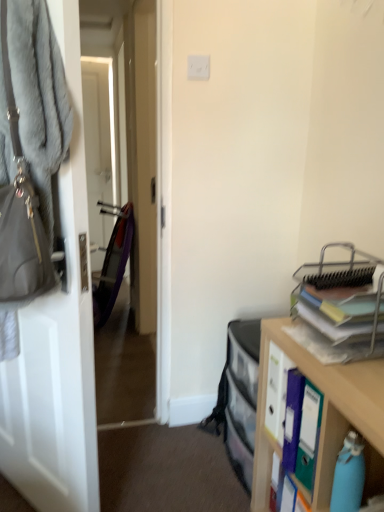
The image size is (384, 512). What are the coordinates of `gray furry handbag at left` in the screenshot? It's located at (20, 215).

This screenshot has height=512, width=384. In order to click on wooden cabinet at right in this screenshot , I will do `click(323, 416)`.

Measure the distance between metallic silver organizer at right and camera.

The distance of metallic silver organizer at right from camera is 1.09 meters.

Image resolution: width=384 pixels, height=512 pixels. What are the coordinates of `metallic silver organizer at right` in the screenshot? It's located at (344, 307).

Where is `gray furry handbag at left`? Image resolution: width=384 pixels, height=512 pixels. gray furry handbag at left is located at coordinates (20, 215).

How far apart are metallic silver organizer at right and wooden cabinet at right?

A distance of 8.04 inches exists between metallic silver organizer at right and wooden cabinet at right.

Consider the image. Is metallic silver organizer at right situated inside wooden cabinet at right or outside?

metallic silver organizer at right cannot be found inside wooden cabinet at right.

Is metallic silver organizer at right in front of or behind wooden cabinet at right in the image?

metallic silver organizer at right is behind wooden cabinet at right.

Does metallic silver organizer at right turn towards wooden cabinet at right?

No, metallic silver organizer at right is not turned towards wooden cabinet at right.

Is gray furry handbag at left at the right side of wooden cabinet at right?

No, gray furry handbag at left is not to the right of wooden cabinet at right.

Could you tell me if gray furry handbag at left is facing wooden cabinet at right?

No, gray furry handbag at left is not turned towards wooden cabinet at right.

From the picture: Can you confirm if gray furry handbag at left is smaller than wooden cabinet at right?

Correct, gray furry handbag at left occupies less space than wooden cabinet at right.

Is gray furry handbag at left directly adjacent to wooden cabinet at right?

No, gray furry handbag at left is not with wooden cabinet at right.

Can you confirm if wooden cabinet at right is wider than gray fuzzy coat at left?

Yes.

Which point is more distant from viewer, (265, 485) or (116, 309)?

The point (116, 309) is farther.

Which of these two, wooden cabinet at right or gray fuzzy coat at left, is bigger?

With larger size is wooden cabinet at right.

Is the position of white matte door at left less distant than that of gray fuzzy coat at left?

Yes, the depth of white matte door at left is less than that of gray fuzzy coat at left.

Is white matte door at left looking in the opposite direction of gray fuzzy coat at left?

Correct, white matte door at left is looking away from gray fuzzy coat at left.

From a real-world perspective, is white matte door at left above or below gray fuzzy coat at left?

From a real-world perspective, white matte door at left is physically below gray fuzzy coat at left.

Are white matte door at left and gray fuzzy coat at left located far from each other?

They are positioned close to each other.

From a real-world perspective, is metallic silver organizer at right positioned above or below gray furry handbag at left?

Clearly, from a real-world perspective, metallic silver organizer at right is below gray furry handbag at left.

Is metallic silver organizer at right situated inside gray furry handbag at left or outside?

metallic silver organizer at right cannot be found inside gray furry handbag at left.

Who is shorter, metallic silver organizer at right or gray furry handbag at left?

Standing shorter between the two is metallic silver organizer at right.

Consider the image. Is the surface of metallic silver organizer at right in direct contact with gray furry handbag at left?

No, metallic silver organizer at right is not next to gray furry handbag at left.

Is gray furry handbag at left inside or outside of white matte door at left?

gray furry handbag at left is not enclosed by white matte door at left.

Which is closer to the camera, (5, 48) or (69, 47)?

Point (5, 48) is positioned closer to the camera compared to point (69, 47).

Find the location of a particular element. The height and width of the screenshot is (512, 384). handbag on the right side of white matte door at left is located at coordinates (20, 215).

From the image's perspective, is gray furry handbag at left under white matte door at left?

No, from the image's perspective, gray furry handbag at left is not beneath white matte door at left.

From the image's perspective, is gray fuzzy coat at left located above metallic silver organizer at right?

Yes, from the image's perspective, gray fuzzy coat at left is on top of metallic silver organizer at right.

Consider the image. Who is shorter, gray fuzzy coat at left or metallic silver organizer at right?

Standing shorter between the two is metallic silver organizer at right.

Does gray fuzzy coat at left turn towards metallic silver organizer at right?

No, gray fuzzy coat at left is not oriented towards metallic silver organizer at right.

How many degrees apart are the facing directions of gray fuzzy coat at left and metallic silver organizer at right?

89.1 degrees separate the facing orientations of gray fuzzy coat at left and metallic silver organizer at right.

Identify the location of cabinetry on the left of metallic silver organizer at right. (323, 416).

This screenshot has width=384, height=512. Identify the location of handbag above the wooden cabinet at right (from a real-world perspective). (20, 215).

When comparing their distances from wooden cabinet at right, does gray furry handbag at left or gray fuzzy coat at left seem further?

gray fuzzy coat at left is further to wooden cabinet at right.

Estimate the real-world distances between objects in this image. Which object is further from metallic silver organizer at right, white matte door at left or gray fuzzy coat at left?

Among the two, gray fuzzy coat at left is located further to metallic silver organizer at right.

When comparing their distances from metallic silver organizer at right, does white matte door at left or gray furry handbag at left seem further?

Among the two, white matte door at left is located further to metallic silver organizer at right.

When comparing their distances from gray fuzzy coat at left, does wooden cabinet at right or white matte door at left seem further?

wooden cabinet at right is further to gray fuzzy coat at left.

Which object lies further to the anchor point wooden cabinet at right, gray fuzzy coat at left or gray furry handbag at left?

gray fuzzy coat at left lies further to wooden cabinet at right than the other object.

Considering their positions, is metallic silver organizer at right positioned further to white matte door at left than gray fuzzy coat at left?

gray fuzzy coat at left is further to white matte door at left.

From the image, which object appears to be nearer to gray fuzzy coat at left, metallic silver organizer at right or wooden cabinet at right?

wooden cabinet at right lies closer to gray fuzzy coat at left than the other object.

Estimate the real-world distances between objects in this image. Which object is further from wooden cabinet at right, white matte door at left or gray fuzzy coat at left?

The object further to wooden cabinet at right is gray fuzzy coat at left.

The image size is (384, 512). I want to click on passage situated between gray furry handbag at left and wooden cabinet at right from left to right, so click(125, 203).

This screenshot has height=512, width=384. Identify the location of cabinetry between gray fuzzy coat at left and metallic silver organizer at right. (323, 416).

You are a GUI agent. You are given a task and a screenshot of the screen. Output one action in this format:
    pyautogui.click(x=<x>, y=<y>)
    Task: Click on the cabinetry between white matte door at left and metallic silver organizer at right from left to right
    Image resolution: width=384 pixels, height=512 pixels.
    Given the screenshot: What is the action you would take?
    pyautogui.click(x=323, y=416)

Locate an element on the screen. The image size is (384, 512). handbag between white matte door at left and wooden cabinet at right is located at coordinates (20, 215).